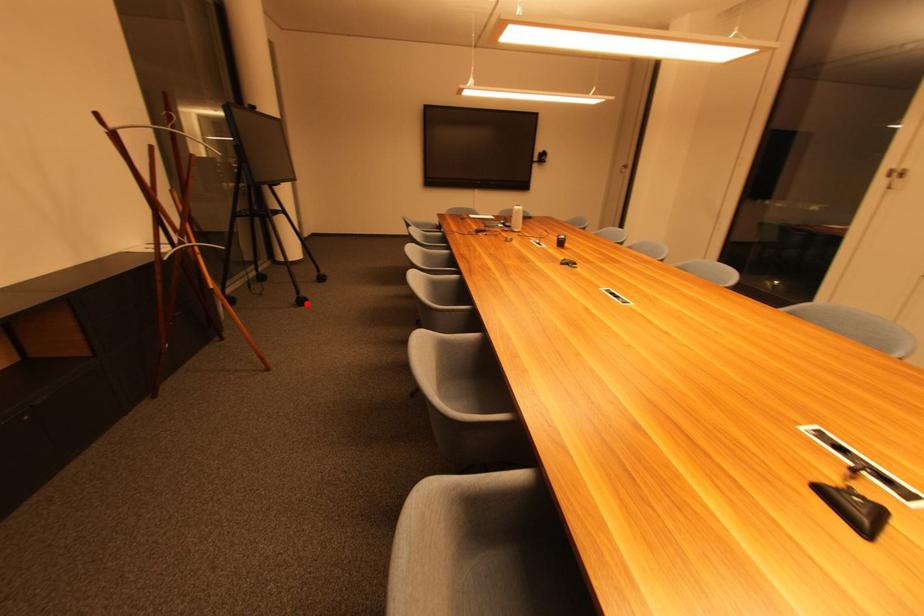
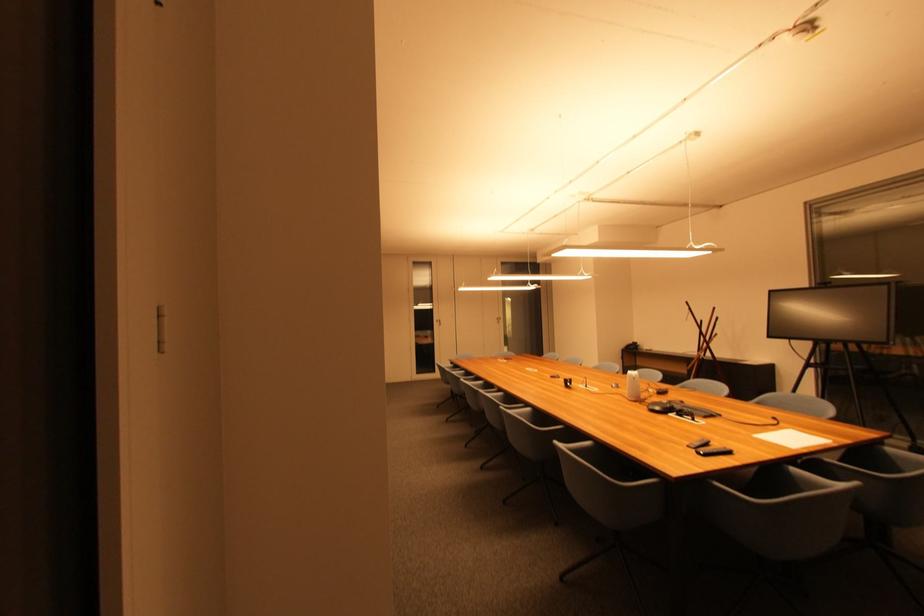
Question: I am providing you with two images of the same scene from different viewpoints. A red point is marked on the first image. Is the red point's position out of view in image 2?

Choices:
 (A) Yes
 (B) No

Answer: (A)